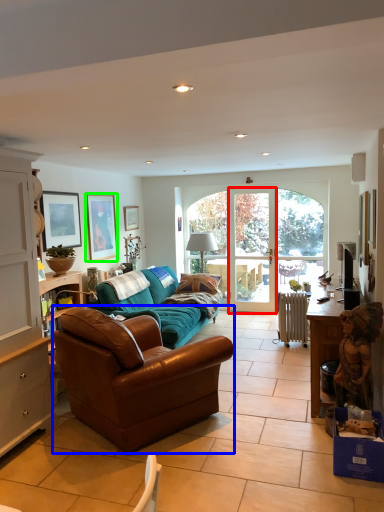
Question: Which object is positioned farthest from screen door (highlighted by a red box)? Select from studio couch (highlighted by a blue box) and picture frame (highlighted by a green box).

Choices:
 (A) studio couch
 (B) picture frame

Answer: (A)